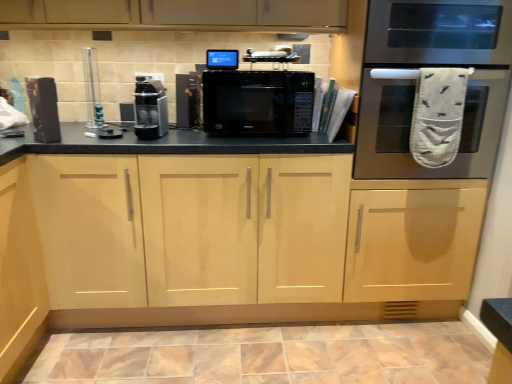
Question: Should I look upward or downward to see black matte microwave at center, the second appliance in the right-to-left sequence?

Choices:
 (A) down
 (B) up

Answer: (B)

Question: Could you tell me if marble-like ceramic tile at lower center is facing clear glass vase at upper left, which ranks as the 4th appliance in right-to-left order?

Choices:
 (A) no
 (B) yes

Answer: (A)

Question: Is marble-like ceramic tile at lower center shorter than clear glass vase at upper left, which ranks as the 4th appliance in right-to-left order?

Choices:
 (A) yes
 (B) no

Answer: (A)

Question: Is marble-like ceramic tile at lower center outside of clear glass vase at upper left, which is the second appliance from left to right?

Choices:
 (A) yes
 (B) no

Answer: (A)

Question: Would you say clear glass vase at upper left, which is the second appliance from left to right, is part of marble-like ceramic tile at lower center's contents?

Choices:
 (A) no
 (B) yes

Answer: (A)

Question: From a real-world perspective, is marble-like ceramic tile at lower center positioned under clear glass vase at upper left, which ranks as the 4th appliance in right-to-left order, based on gravity?

Choices:
 (A) yes
 (B) no

Answer: (A)

Question: Considering the relative positions of marble-like ceramic tile at lower center and clear glass vase at upper left, which is the second appliance from left to right, in the image provided, is marble-like ceramic tile at lower center behind clear glass vase at upper left, which is the second appliance from left to right,?

Choices:
 (A) yes
 (B) no

Answer: (B)

Question: Does blue glossy monitor at upper center, the first appliance viewed from the right, turn towards satin black coffee machine at center, the third appliance from the right?

Choices:
 (A) no
 (B) yes

Answer: (A)

Question: Is blue glossy monitor at upper center, the first appliance viewed from the right, bigger than satin black coffee machine at center, which appears as the third appliance when viewed from the left?

Choices:
 (A) no
 (B) yes

Answer: (A)

Question: From a real-world perspective, is blue glossy monitor at upper center, positioned as the 5th appliance in left-to-right order, located beneath satin black coffee machine at center, which appears as the third appliance when viewed from the left?

Choices:
 (A) no
 (B) yes

Answer: (A)

Question: Considering the relative positions of blue glossy monitor at upper center, the first appliance viewed from the right, and satin black coffee machine at center, the third appliance from the right, in the image provided, is blue glossy monitor at upper center, the first appliance viewed from the right, to the left of satin black coffee machine at center, the third appliance from the right, from the viewer's perspective?

Choices:
 (A) no
 (B) yes

Answer: (A)

Question: Is there a large distance between blue glossy monitor at upper center, the first appliance viewed from the right, and satin black coffee machine at center, which appears as the third appliance when viewed from the left?

Choices:
 (A) yes
 (B) no

Answer: (B)

Question: Is blue glossy monitor at upper center, positioned as the 5th appliance in left-to-right order, wider than satin black coffee machine at center, the third appliance from the right?

Choices:
 (A) no
 (B) yes

Answer: (A)

Question: Does matte black speaker at left, arranged as the 1th appliance when viewed from the left, appear on the right side of satin black coffee machine at center, which appears as the third appliance when viewed from the left?

Choices:
 (A) yes
 (B) no

Answer: (B)